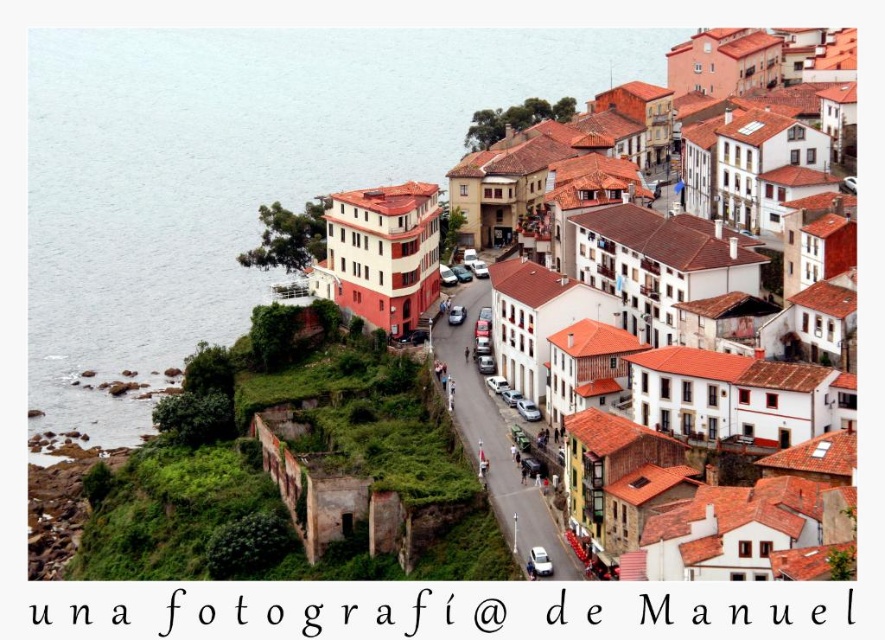
Is blue water at left shorter than white matte building at center?

Incorrect, blue water at left's height does not fall short of white matte building at center's.

Between blue water at left and white matte building at center, which one is positioned higher?

blue water at left is above.

Does point (366, 51) come behind point (687, 106)?

Yes, point (366, 51) is farther from viewer.

This screenshot has height=640, width=885. I want to click on blue water at left, so pyautogui.click(x=237, y=168).

Which is above, white matte building at center or white stucco buildings at center?

white matte building at center is higher up.

Does white matte building at center appear on the left side of white stucco buildings at center?

Incorrect, white matte building at center is not on the left side of white stucco buildings at center.

Between point (721, 122) and point (483, 413), which one is positioned behind?

The point (721, 122) is behind.

I want to click on white matte building at center, so click(x=653, y=296).

Does point (43, 35) come in front of point (526, 536)?

That is False.

Does blue water at left have a lesser height compared to white stucco buildings at center?

Incorrect, blue water at left's height does not fall short of white stucco buildings at center's.

Locate an element on the screen. The width and height of the screenshot is (885, 640). blue water at left is located at coordinates (237, 168).